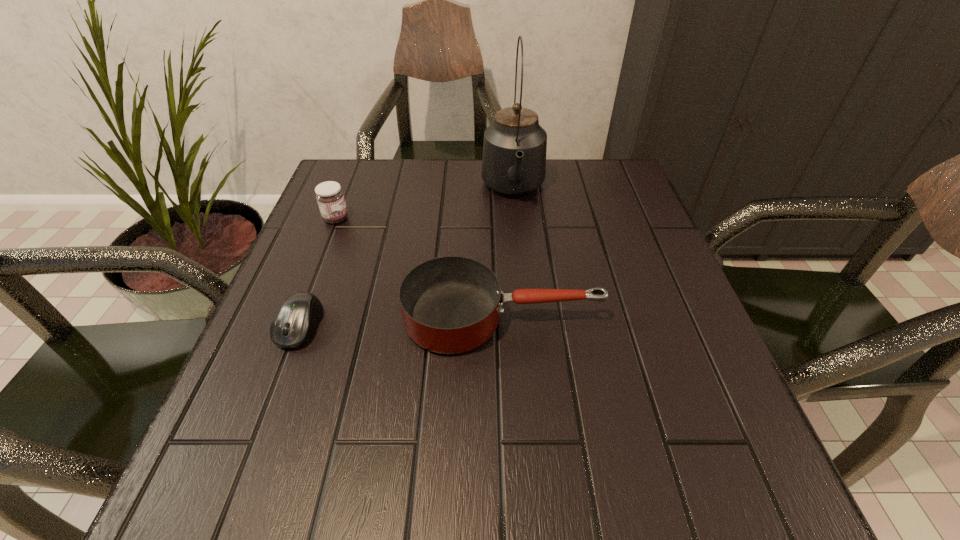
Identify the location of vacant space that's between the pan and the shortest object. (401, 322).

The height and width of the screenshot is (540, 960). In order to click on vacant point located between the jam and the mouse in this screenshot , I will do `click(318, 272)`.

Identify the location of free space between the kettle and the shortest object. (407, 258).

Find the location of a particular element. The image size is (960, 540). free space between the jam and the shortest object is located at coordinates (318, 272).

At what (x,y) coordinates should I click in order to perform the action: click on vacant region between the jam and the mouse. Please return your answer as a coordinate pair (x, y). Looking at the image, I should click on (318, 272).

Image resolution: width=960 pixels, height=540 pixels. In order to click on empty space between the tallest object and the pan in this screenshot , I will do `click(508, 254)`.

Select which object is the second closest to the pan. Please provide its 2D coordinates. Your answer should be formatted as a tuple, i.e. [(x, y)], where the tuple contains the x and y coordinates of a point satisfying the conditions above.

[(514, 150)]

Where is `the third closest object to the pan`? the third closest object to the pan is located at coordinates (329, 195).

This screenshot has height=540, width=960. Identify the location of free space that satisfies the following two spatial constraints: 1. spout on the tallest object; 2. on the front label of the jam. (516, 219).

Identify the location of vacant region that satisfies the following two spatial constraints: 1. on the front label of the jam; 2. on the left side of the mouse. The image size is (960, 540). (294, 326).